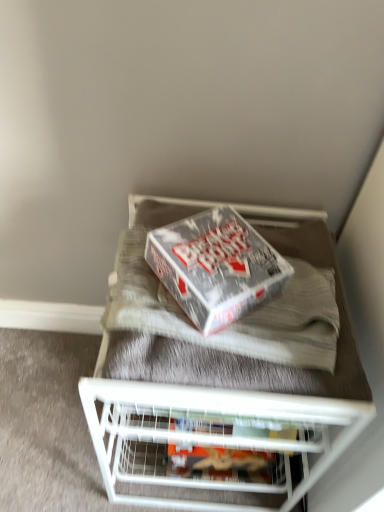
You are a GUI agent. You are given a task and a screenshot of the screen. Output one action in this format:
    pyautogui.click(x=<x>, y=<y>)
    Task: Click on the space that is in front of silver metallic box at center
    The height and width of the screenshot is (512, 384).
    Given the screenshot: What is the action you would take?
    pyautogui.click(x=218, y=374)